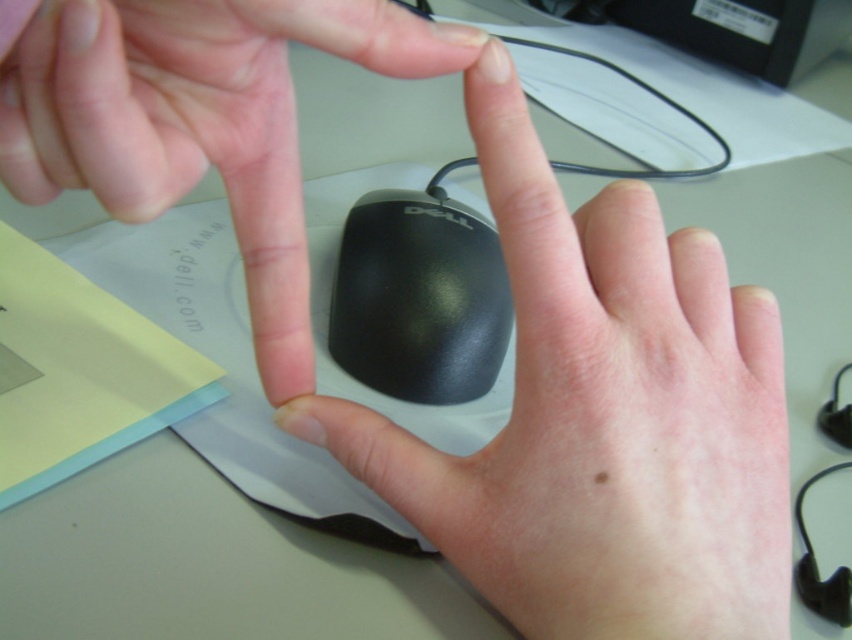
Is smooth skin hand at center further to camera compared to black glossy mouse at center?

No, it is in front of black glossy mouse at center.

Which is in front, point (688, 436) or point (422, 244)?

Point (688, 436) is in front.

The height and width of the screenshot is (640, 852). What do you see at coordinates (591, 416) in the screenshot?
I see `smooth skin hand at center` at bounding box center [591, 416].

Identify the location of smooth skin hand at center. (591, 416).

Between matte black mouse at center and black glossy mouse at center, which one appears on the left side from the viewer's perspective?

matte black mouse at center

Can you confirm if matte black mouse at center is taller than black glossy mouse at center?

Yes.

Measure the distance between point (14, 32) and camera.

Point (14, 32) and camera are 7.17 inches apart from each other.

You are a GUI agent. You are given a task and a screenshot of the screen. Output one action in this format:
    pyautogui.click(x=<x>, y=<y>)
    Task: Click on the matte black mouse at center
    
    Given the screenshot: What is the action you would take?
    pyautogui.click(x=196, y=122)

Is point (277, 401) closer to viewer compared to point (476, 33)?

That is False.

Which is more to the left, smooth skin hand at center or matte black mouse at center?

matte black mouse at center is more to the left.

Who is more distant from viewer, (475, 577) or (125, 68)?

The point (475, 577) is behind.

The width and height of the screenshot is (852, 640). I want to click on smooth skin hand at center, so click(x=591, y=416).